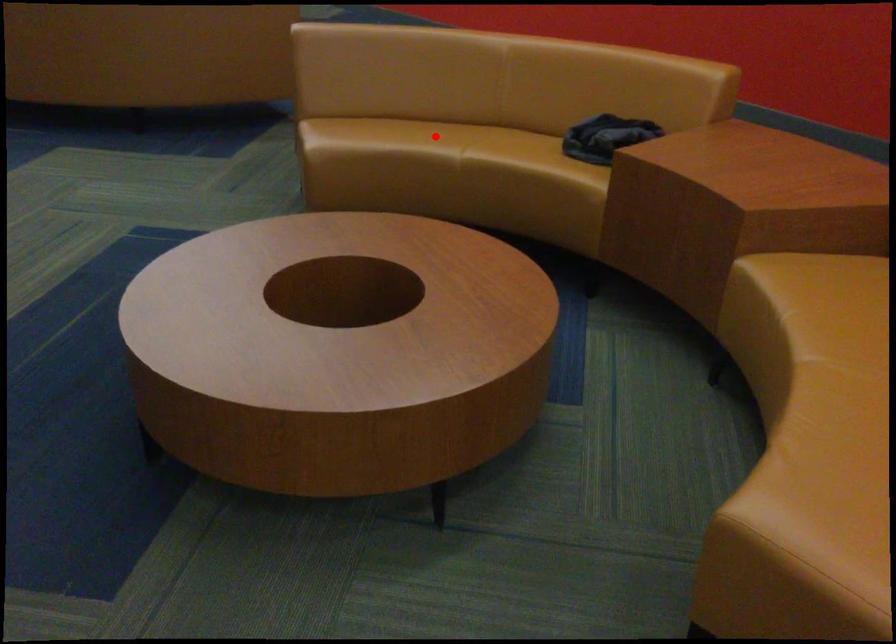
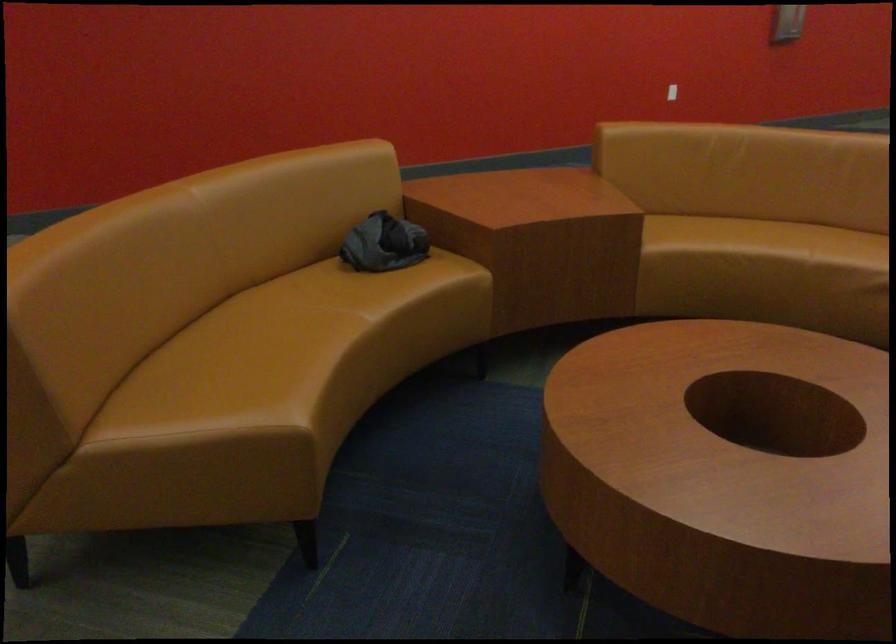
Question: A red point is marked in image1. In image2, is the corresponding 3D point closer to the camera or farther? Reply with the corresponding letter.

Choices:
 (A) The corresponding 3D point is closer.
 (B) The corresponding 3D point is farther.

Answer: (A)